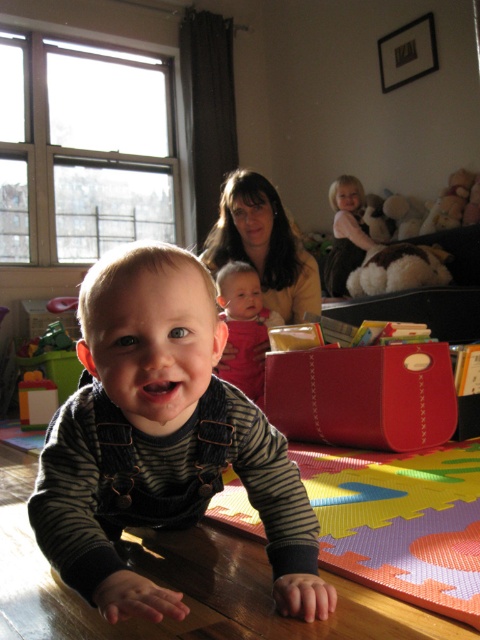
Question: Among these objects, which one is nearest to the camera?

Choices:
 (A) striped denim overalls at center
 (B) multicolored foam puzzle mat at lower center
 (C) soft pink fabric baby at center

Answer: (A)

Question: Is striped denim overalls at center wider than soft pink fabric baby at center?

Choices:
 (A) yes
 (B) no

Answer: (A)

Question: Which object appears farthest from the camera in this image?

Choices:
 (A) striped denim overalls at center
 (B) soft pink fabric baby at center

Answer: (B)

Question: Among these points, which one is farthest from the camera?

Choices:
 (A) (303, 310)
 (B) (93, 289)
 (C) (273, 321)

Answer: (A)

Question: Does striped denim overalls at center appear over soft pink fabric baby at center?

Choices:
 (A) yes
 (B) no

Answer: (B)

Question: Is the position of multicolored foam puzzle mat at lower center more distant than that of soft pink fabric baby at center?

Choices:
 (A) no
 (B) yes

Answer: (A)